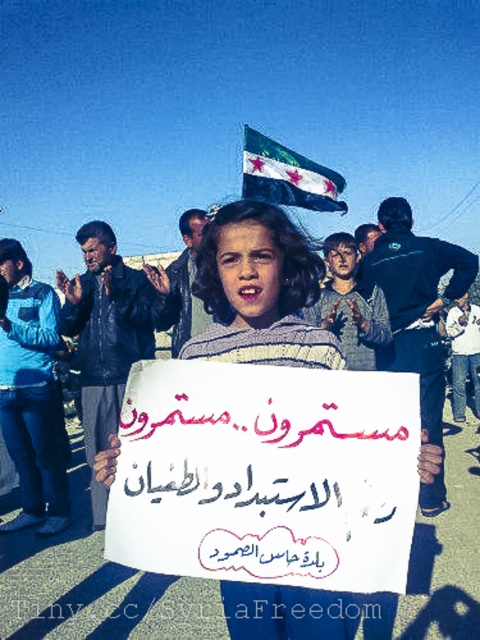
Does white striped sweater at center lie behind dark blue fabric flag at upper center?

No, it is not.

Does white striped sweater at center have a greater width compared to dark blue fabric flag at upper center?

No.

Where is `white striped sweater at center`? The height and width of the screenshot is (640, 480). white striped sweater at center is located at coordinates (259, 291).